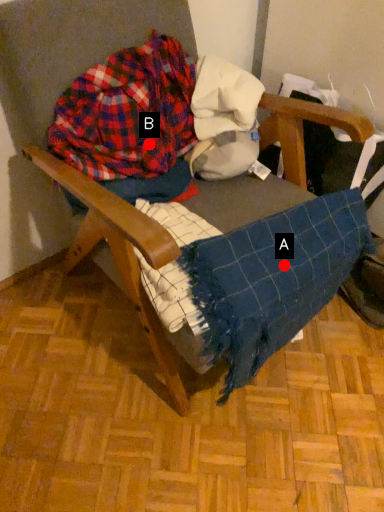
Question: Two points are circled on the image, labeled by A and B beside each circle. Among these points, which one is nearest to the camera?

Choices:
 (A) A is closer
 (B) B is closer

Answer: (A)